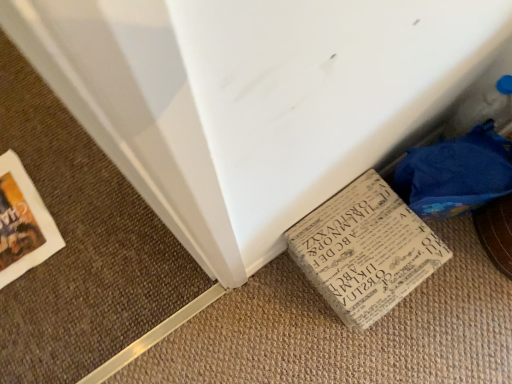
Question: Should I look upward or downward to see printed paper book at lower right?

Choices:
 (A) up
 (B) down

Answer: (B)

Question: Can we say white paper puzzle at lower right lies outside printed paper book at lower right?

Choices:
 (A) yes
 (B) no

Answer: (A)

Question: Does white paper puzzle at lower right appear on the right side of printed paper book at lower right?

Choices:
 (A) yes
 (B) no

Answer: (A)

Question: Is white paper puzzle at lower right bigger than printed paper book at lower right?

Choices:
 (A) no
 (B) yes

Answer: (A)

Question: Considering the relative sizes of white paper puzzle at lower right and printed paper book at lower right in the image provided, is white paper puzzle at lower right thinner than printed paper book at lower right?

Choices:
 (A) yes
 (B) no

Answer: (A)

Question: Is the depth of white paper puzzle at lower right greater than that of printed paper book at lower right?

Choices:
 (A) yes
 (B) no

Answer: (B)

Question: Is white paper puzzle at lower right oriented away from printed paper book at lower right?

Choices:
 (A) no
 (B) yes

Answer: (A)

Question: Can you confirm if printed paper book at lower right is thinner than white paper puzzle at lower right?

Choices:
 (A) yes
 (B) no

Answer: (B)

Question: Is printed paper book at lower right positioned with its back to white paper puzzle at lower right?

Choices:
 (A) no
 (B) yes

Answer: (A)

Question: Is printed paper book at lower right further to the viewer compared to white paper puzzle at lower right?

Choices:
 (A) yes
 (B) no

Answer: (A)

Question: From the image's perspective, does printed paper book at lower right appear higher than white paper puzzle at lower right?

Choices:
 (A) yes
 (B) no

Answer: (B)

Question: Is printed paper book at lower right at the right side of white paper puzzle at lower right?

Choices:
 (A) no
 (B) yes

Answer: (A)

Question: Is printed paper book at lower right to the left of white paper puzzle at lower right from the viewer's perspective?

Choices:
 (A) no
 (B) yes

Answer: (B)

Question: Is white paper puzzle at lower right inside the boundaries of printed paper book at lower right, or outside?

Choices:
 (A) inside
 (B) outside

Answer: (B)